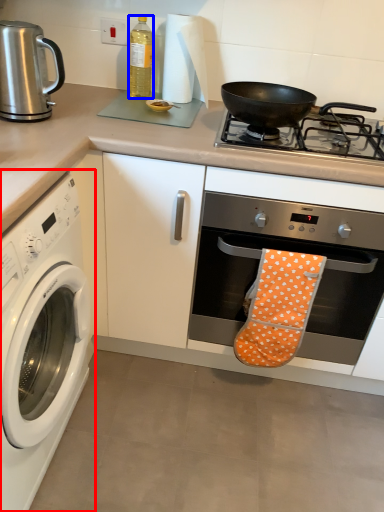
Question: Among these objects, which one is farthest to the camera, washing machine (highlighted by a red box) or bottle (highlighted by a blue box)?

Choices:
 (A) washing machine
 (B) bottle

Answer: (B)